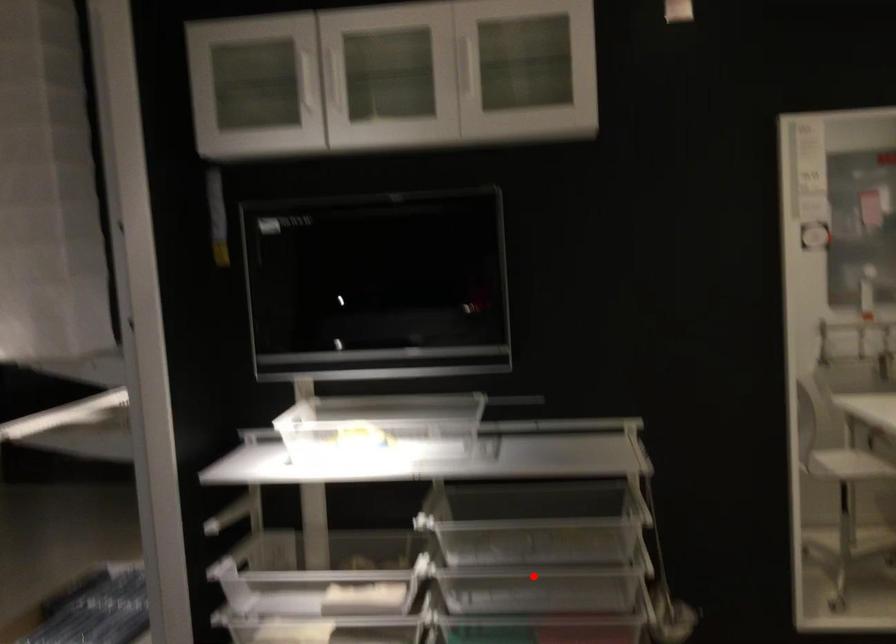
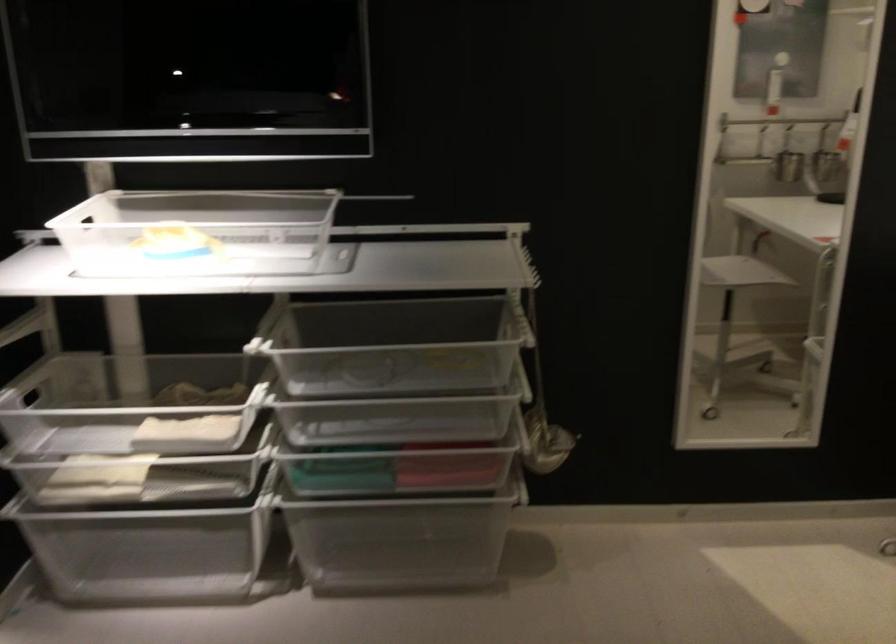
Question: I am providing you with two images of the same scene from different viewpoints. In image1, a red point is highlighted. Considering the same 3D point in image2, which of the following is correct?

Choices:
 (A) It is closer
 (B) It is farther

Answer: (A)